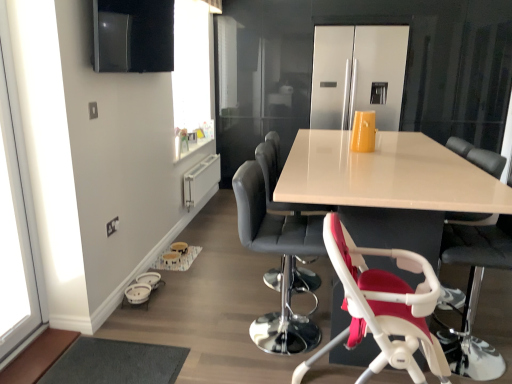
Image resolution: width=512 pixels, height=384 pixels. What are the coordinates of `free space to the back side of black leather bar stool at center, which is the 3th chair from front to back` in the screenshot? It's located at (257, 294).